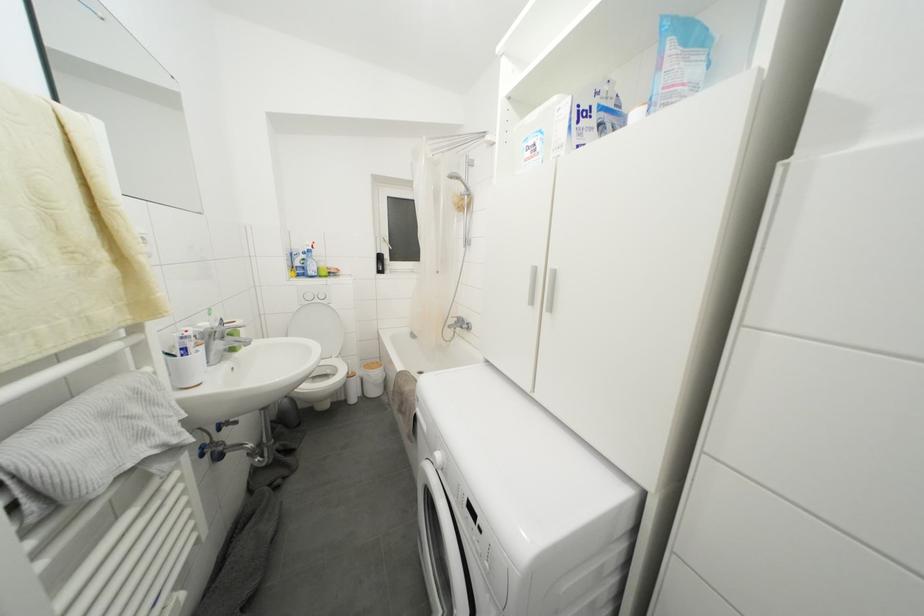
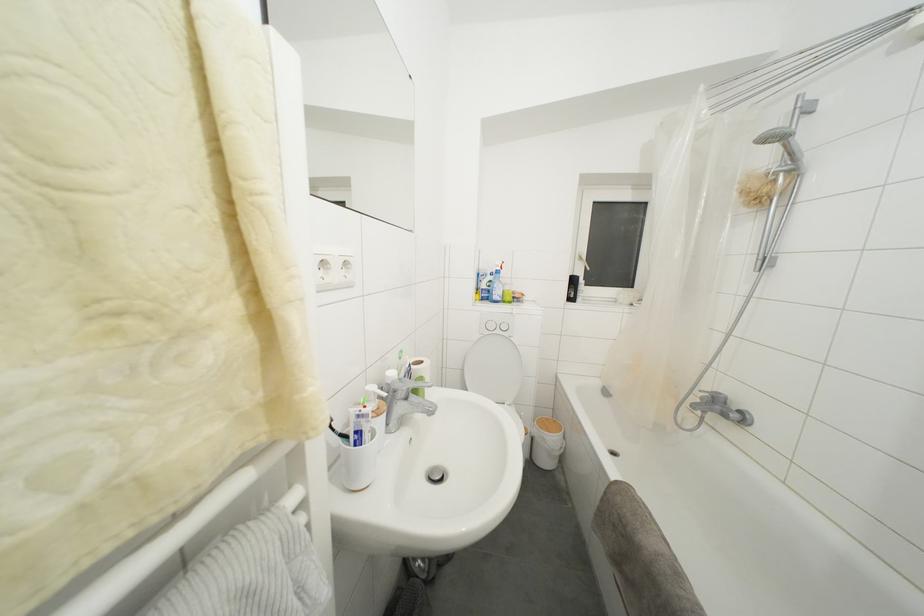
Where in the second image is the point corresponding to (x=306, y=277) from the first image?

(490, 301)